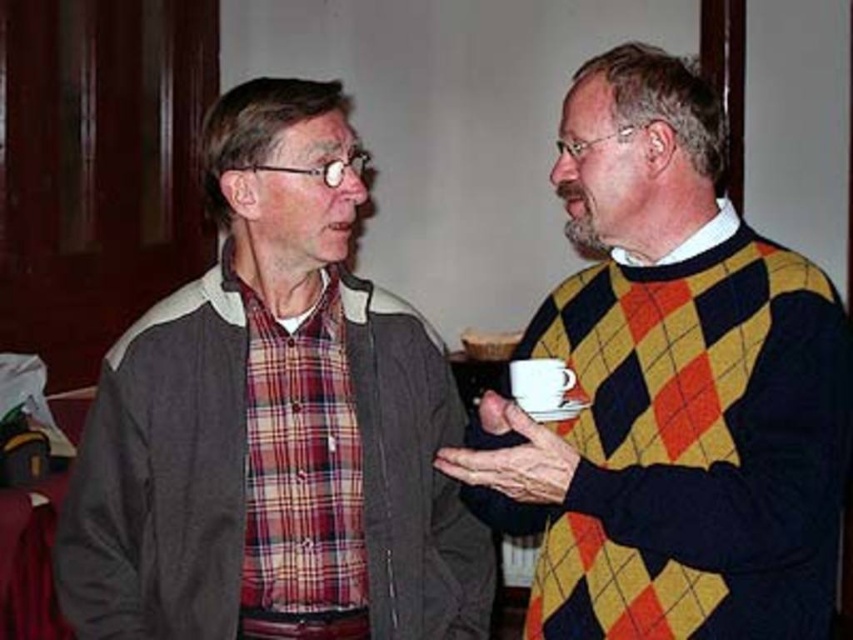
You are a photographer standing at the camera position. You want to take a closeup shot of the plaid fabric shirt at center. Given that your camera has a minimum focusing distance of 5 feet, can you achieve a clear photo?

The plaid fabric shirt at center is 5.22 feet away from camera, which is just beyond the minimum focusing distance of 5 feet. Therefore, you can take a clear photo as it is within range.

You are a photographer setting up for a group photo. You need to position the plaid fabric shirt at center and the yellow argyle sweater at right so that both fit within a 3.5 meter wide frame. Given their widths, will both individuals fit side by side without overlapping?

The plaid fabric shirt at center is wider than the yellow argyle sweater at right. Since the total width of both would exceed 3.5 meters, they cannot fit side by side without overlapping.

You are at a social event and want to approach the two people in the image. The person wearing the plaid fabric shirt at center is to the left of the yellow argyle sweater at right. Which direction should you walk to get closer to both individuals without passing between them?

Since the plaid fabric shirt at center is to the left of the yellow argyle sweater at right, you should walk towards the left side to approach both individuals without passing between them.